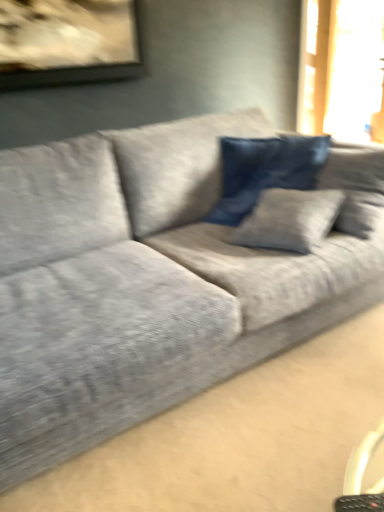
This screenshot has width=384, height=512. Identify the location of velvet dark blue pillow at center. (265, 170).

The width and height of the screenshot is (384, 512). What do you see at coordinates (265, 170) in the screenshot?
I see `velvet dark blue pillow at center` at bounding box center [265, 170].

Measure the distance between point (313, 162) and camera.

Point (313, 162) is 6.22 feet away from camera.

Find the location of `velvet dark blue pillow at center`. velvet dark blue pillow at center is located at coordinates (265, 170).